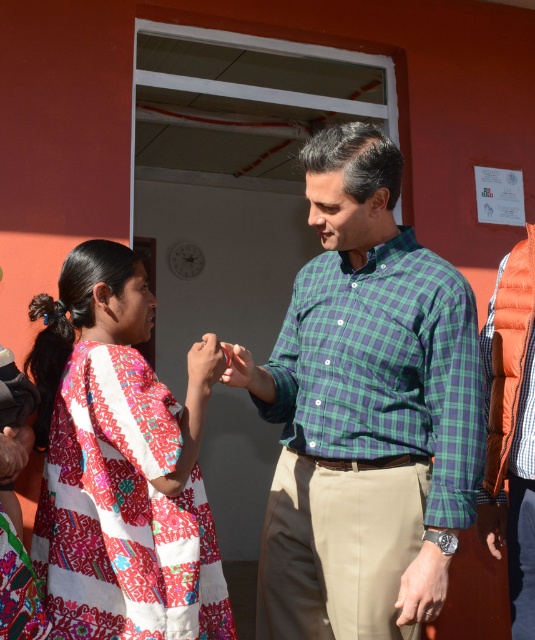
Question: Among these points, which one is nearest to the camera?

Choices:
 (A) coord(361,301)
 (B) coord(188,358)

Answer: (B)

Question: Can you confirm if embroidered cotton dress at center is positioned below smooth skin hand at center?

Choices:
 (A) no
 (B) yes

Answer: (B)

Question: Which object is the closest to the embroidered cotton dress at center?

Choices:
 (A) smooth skin hand at center
 (B) green plaid shirt at center

Answer: (A)

Question: Is embroidered cotton dress at center to the left of smooth skin hand at center from the viewer's perspective?

Choices:
 (A) no
 (B) yes

Answer: (B)

Question: Which object appears closest to the camera in this image?

Choices:
 (A) smooth skin hand at center
 (B) green plaid shirt at center
 (C) embroidered cotton dress at center

Answer: (C)

Question: Where is embroidered cotton dress at center located in relation to smooth skin hand at center in the image?

Choices:
 (A) below
 (B) above

Answer: (A)